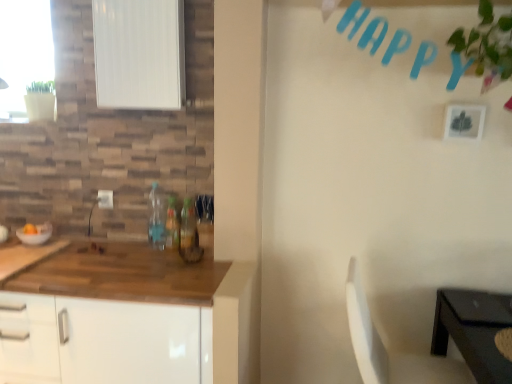
Identify the location of free space in front of translucent glass bottle at center, the third bottle positioned from the left. The height and width of the screenshot is (384, 512). (180, 257).